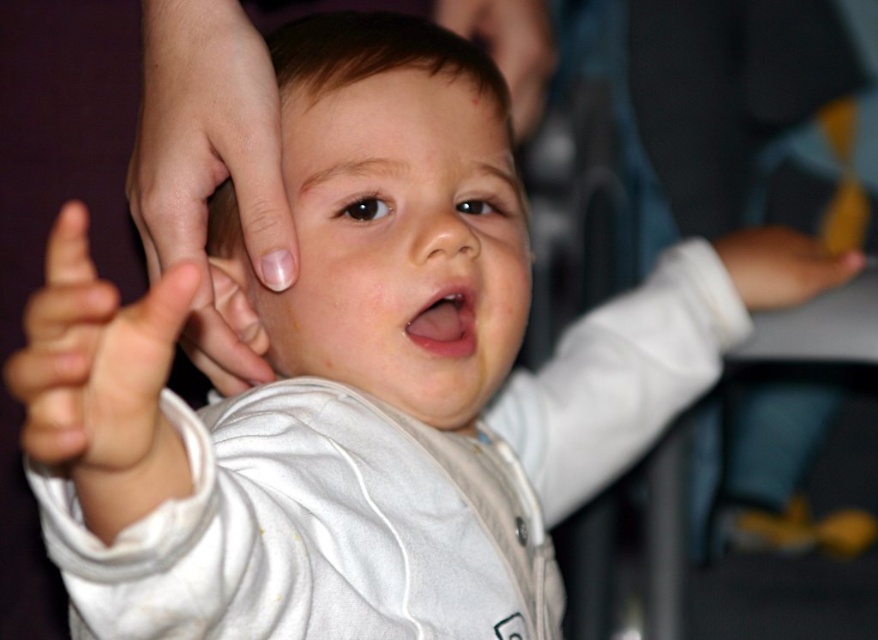
Question: Which point is closer to the camera taking this photo?

Choices:
 (A) (144, 161)
 (B) (751, 298)

Answer: (A)

Question: Observing the image, what is the correct spatial positioning of smooth skin hand at center in reference to white soft hand at left?

Choices:
 (A) below
 (B) above

Answer: (B)

Question: Can you confirm if white soft hand at left is thinner than smooth skin hand at upper right?

Choices:
 (A) yes
 (B) no

Answer: (A)

Question: Which of the following is the farthest from the observer?

Choices:
 (A) smooth skin hand at center
 (B) white soft hand at left
 (C) smooth skin hand at upper right

Answer: (C)

Question: Based on their relative distances, which object is farther from the white soft hand at left?

Choices:
 (A) smooth skin hand at upper right
 (B) smooth skin hand at center

Answer: (A)

Question: Can you confirm if white soft hand at left is wider than smooth skin hand at upper right?

Choices:
 (A) no
 (B) yes

Answer: (A)